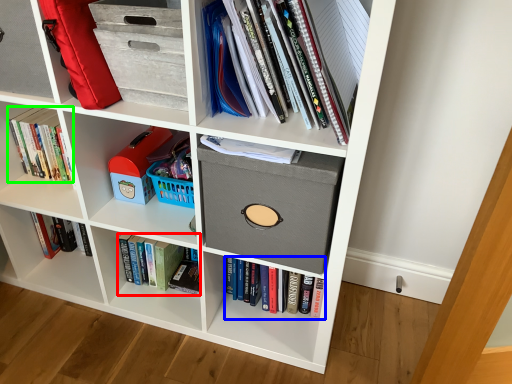
Question: Considering the real-world distances, which object is farthest from book (highlighted by a red box)? book (highlighted by a blue box) or book (highlighted by a green box)?

Choices:
 (A) book
 (B) book

Answer: (B)